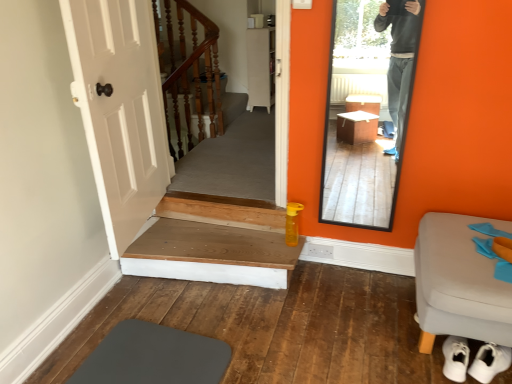
Question: Is wooden at bottom, the 1th stairs when ordered from front to back, wider or thinner than wooden at upper left, arranged as the 1th stairs when viewed from the back?

Choices:
 (A) thin
 (B) wide

Answer: (A)

Question: Considering the positions of point (239, 269) and point (177, 104), is point (239, 269) closer or farther from the camera than point (177, 104)?

Choices:
 (A) closer
 (B) farther

Answer: (A)

Question: Considering the real-world distances, which object is farthest from the white fabric stool at lower right?

Choices:
 (A) white matte cabinet at center
 (B) wooden at bottom, which is the 2th stairs from back to front
 (C) clear glass mirror at right
 (D) wooden at upper left, arranged as the 1th stairs when viewed from the back

Answer: (A)

Question: Which object is the closest to the wooden at upper left, arranged as the 1th stairs when viewed from the back?

Choices:
 (A) white fabric stool at lower right
 (B) clear glass mirror at right
 (C) white matte cabinet at center
 (D) wooden at bottom, which is the 2th stairs from back to front

Answer: (C)